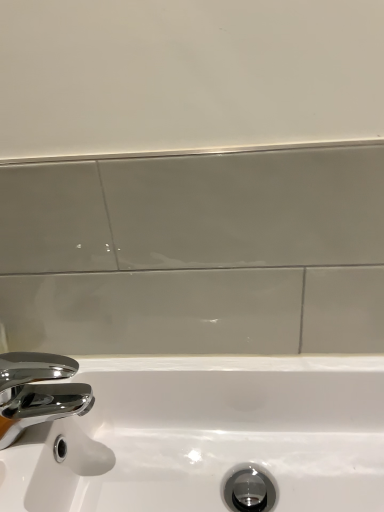
Question: Is chrome/metallic faucet at lower left in contact with white glossy sink at lower left?

Choices:
 (A) no
 (B) yes

Answer: (A)

Question: Could you tell me if chrome/metallic faucet at lower left is facing white glossy sink at lower left?

Choices:
 (A) no
 (B) yes

Answer: (A)

Question: Considering the relative positions of chrome/metallic faucet at lower left and white glossy sink at lower left in the image provided, is chrome/metallic faucet at lower left to the right of white glossy sink at lower left from the viewer's perspective?

Choices:
 (A) no
 (B) yes

Answer: (A)

Question: Considering the relative sizes of chrome/metallic faucet at lower left and white glossy sink at lower left in the image provided, is chrome/metallic faucet at lower left wider than white glossy sink at lower left?

Choices:
 (A) no
 (B) yes

Answer: (A)

Question: Does chrome/metallic faucet at lower left have a lesser width compared to white glossy sink at lower left?

Choices:
 (A) no
 (B) yes

Answer: (B)

Question: Can you confirm if chrome/metallic faucet at lower left is taller than white glossy sink at lower left?

Choices:
 (A) yes
 (B) no

Answer: (B)

Question: From the image's perspective, does white glossy sink at lower left appear lower than chrome/metallic faucet at lower left?

Choices:
 (A) no
 (B) yes

Answer: (B)

Question: Is white glossy sink at lower left wider than chrome/metallic faucet at lower left?

Choices:
 (A) no
 (B) yes

Answer: (B)

Question: Considering the relative sizes of white glossy sink at lower left and chrome/metallic faucet at lower left in the image provided, is white glossy sink at lower left taller than chrome/metallic faucet at lower left?

Choices:
 (A) yes
 (B) no

Answer: (A)

Question: Could you tell me if white glossy sink at lower left is turned towards chrome/metallic faucet at lower left?

Choices:
 (A) yes
 (B) no

Answer: (B)

Question: From a real-world perspective, is white glossy sink at lower left physically above chrome/metallic faucet at lower left?

Choices:
 (A) yes
 (B) no

Answer: (B)

Question: Is white glossy sink at lower left far away from chrome/metallic faucet at lower left?

Choices:
 (A) no
 (B) yes

Answer: (A)

Question: Which is correct: chrome/metallic faucet at lower left is inside white glossy sink at lower left, or outside of it?

Choices:
 (A) inside
 (B) outside

Answer: (B)